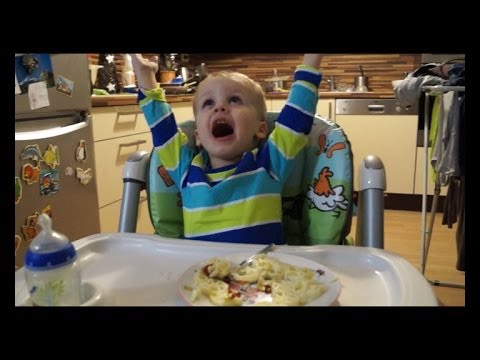
You are a GUI agent. You are given a task and a screenshot of the screen. Output one action in this format:
    pyautogui.click(x=<x>, y=<y>)
    Task: Click on the floors
    This screenshot has width=480, height=360.
    Given the screenshot: What is the action you would take?
    pyautogui.click(x=402, y=224)